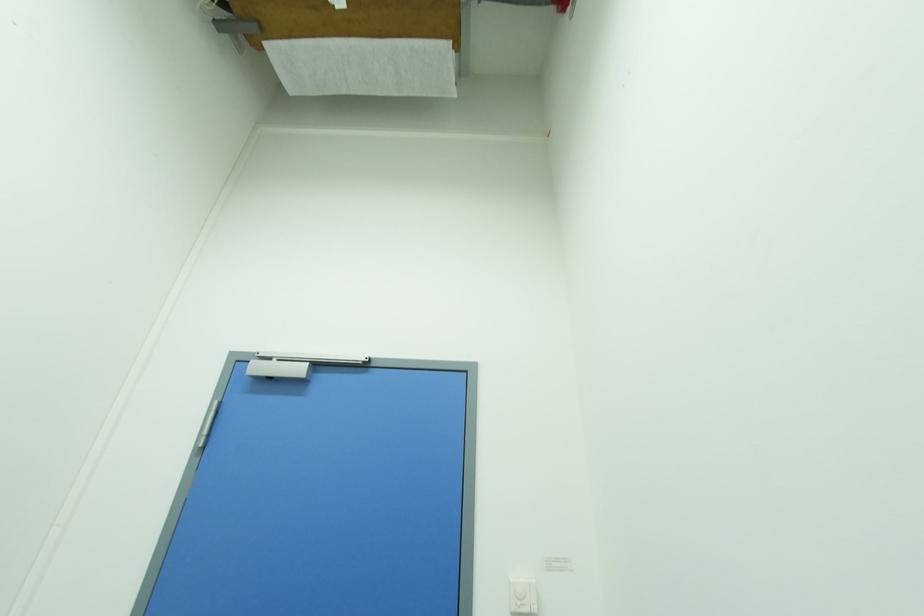
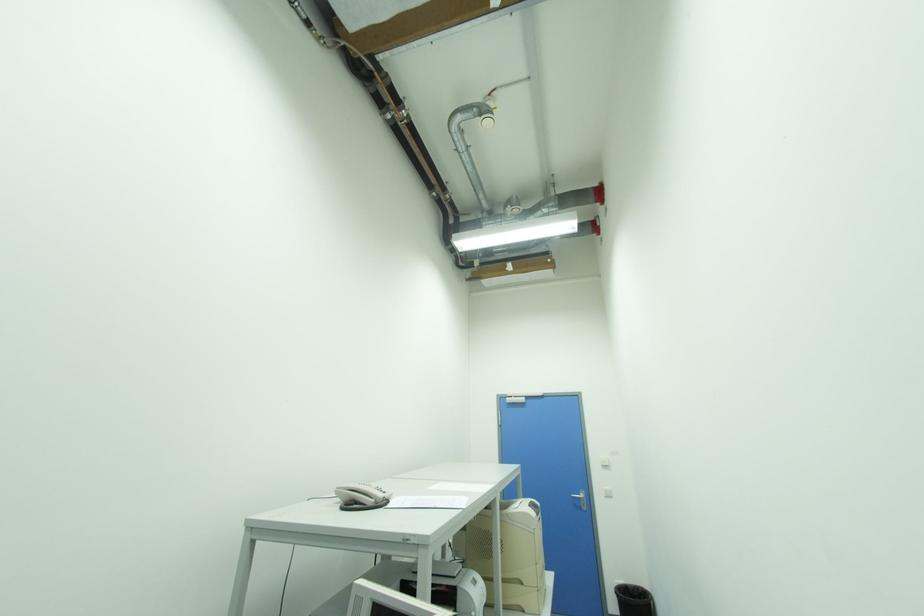
Question: What movement of the cameraman would produce the second image?

Choices:
 (A) Left
 (B) Right
 (C) Forward
 (D) Backward

Answer: (D)